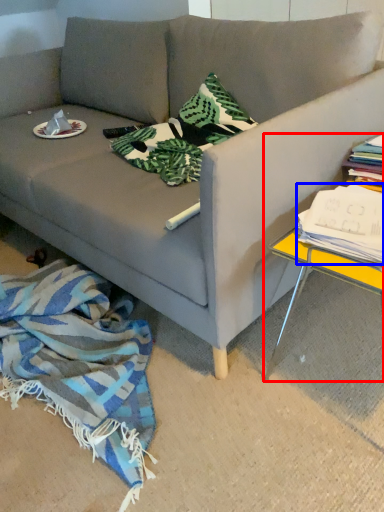
Question: Among these objects, which one is nearest to the camera, table (highlighted by a red box) or magazine (highlighted by a blue box)?

Choices:
 (A) table
 (B) magazine

Answer: (A)